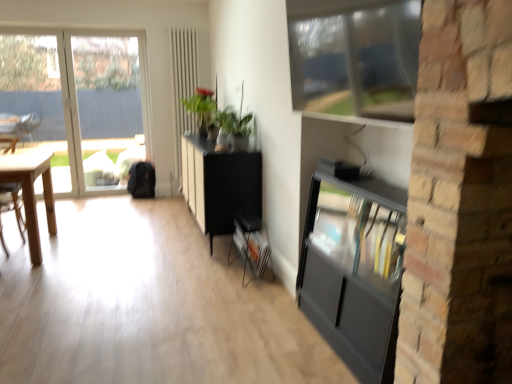
Find the location of `free space between black matte cabinet at center and metallic gray magazine rack at center`. free space between black matte cabinet at center and metallic gray magazine rack at center is located at coordinates (220, 264).